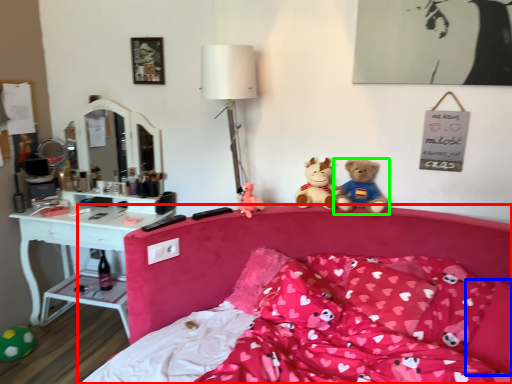
Question: Considering the real-world distances, which object is closest to bed (highlighted by a red box)? pillow (highlighted by a blue box) or teddy bear (highlighted by a green box).

Choices:
 (A) pillow
 (B) teddy bear

Answer: (B)